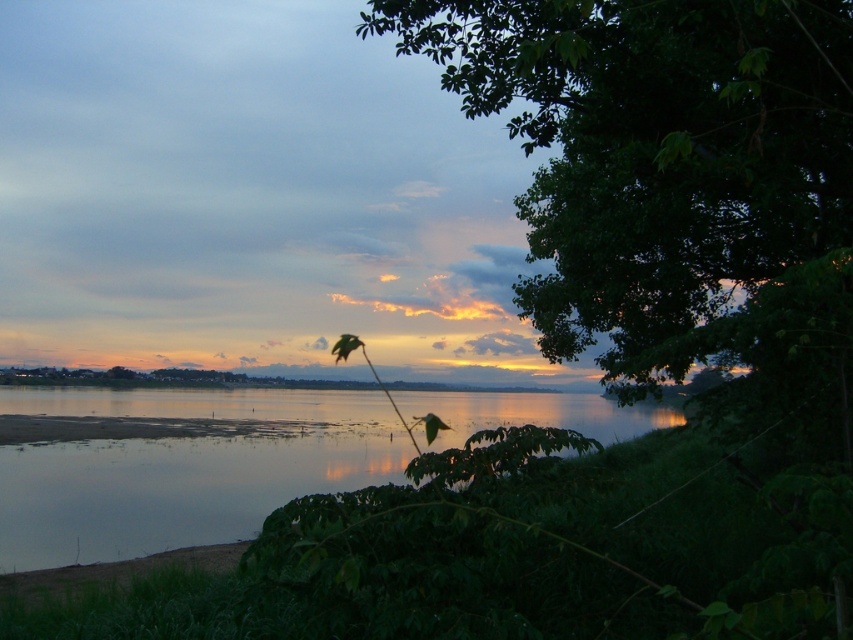
Question: Which point is closer to the camera taking this photo?

Choices:
 (A) (352, 419)
 (B) (708, 205)

Answer: (B)

Question: Observing the image, what is the correct spatial positioning of green leafy tree at upper right in reference to silvery reflective water at center?

Choices:
 (A) below
 (B) above

Answer: (B)

Question: Among these points, which one is farthest from the camera?

Choices:
 (A) (114, 536)
 (B) (563, 300)

Answer: (B)

Question: Is green leafy tree at upper right to the left of silvery reflective water at center from the viewer's perspective?

Choices:
 (A) yes
 (B) no

Answer: (B)

Question: Among these points, which one is nearest to the camera?

Choices:
 (A) (19, 554)
 (B) (779, 120)

Answer: (B)

Question: Can you confirm if green leafy tree at upper right is bigger than silvery reflective water at center?

Choices:
 (A) yes
 (B) no

Answer: (A)